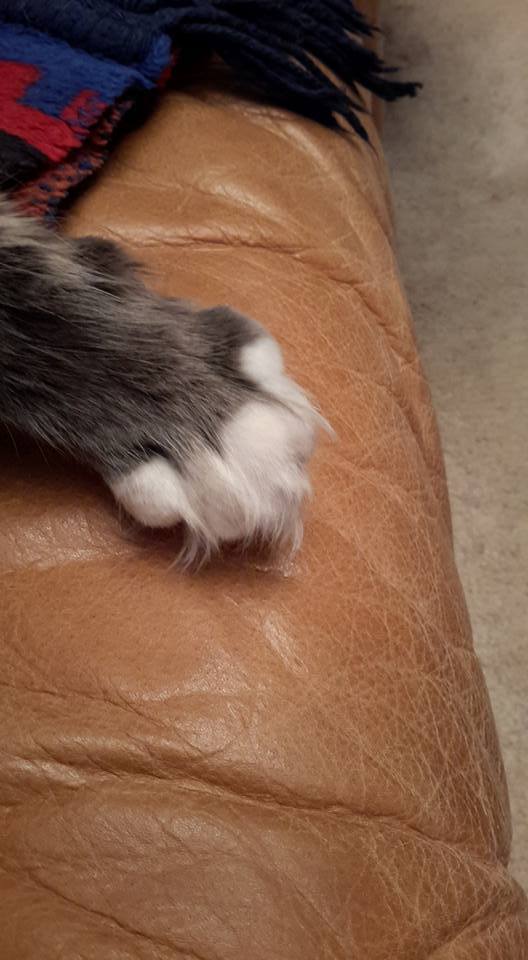
At what (x,y) coordinates should I click in order to perform the action: click on carpet. Please return your answer as a coordinate pair (x, y). Looking at the image, I should click on pyautogui.click(x=472, y=472).